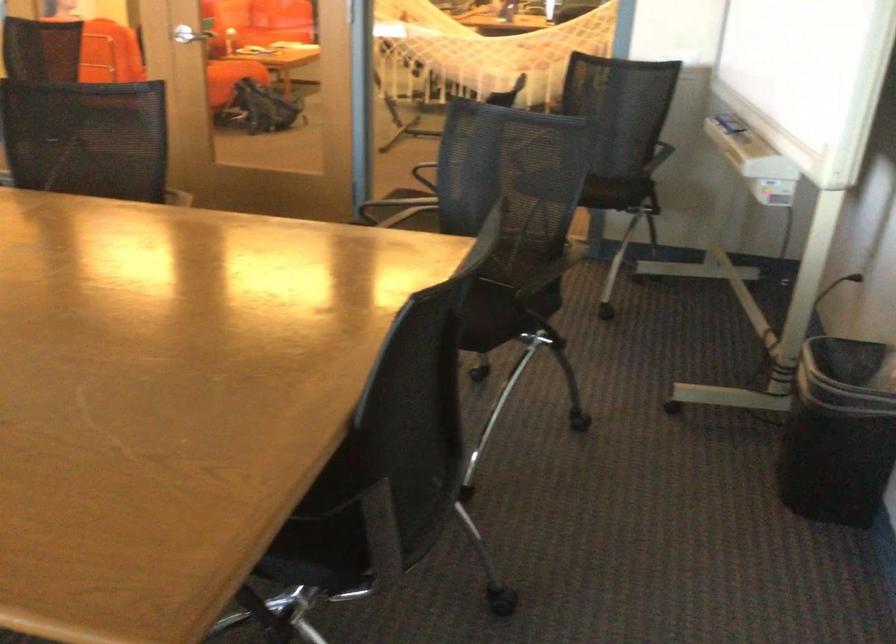
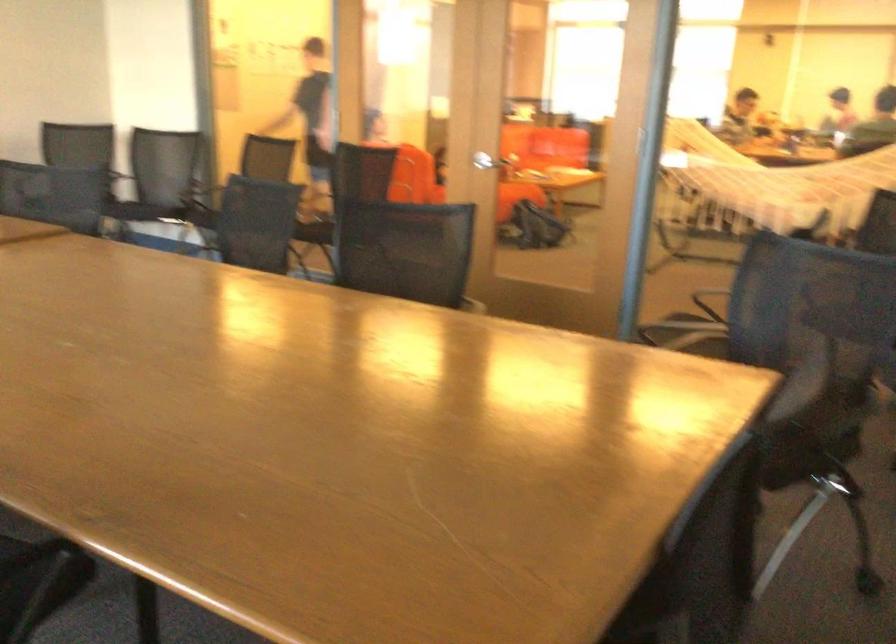
In the second image, find the point that corresponds to pixel 248 107 in the first image.

(533, 228)